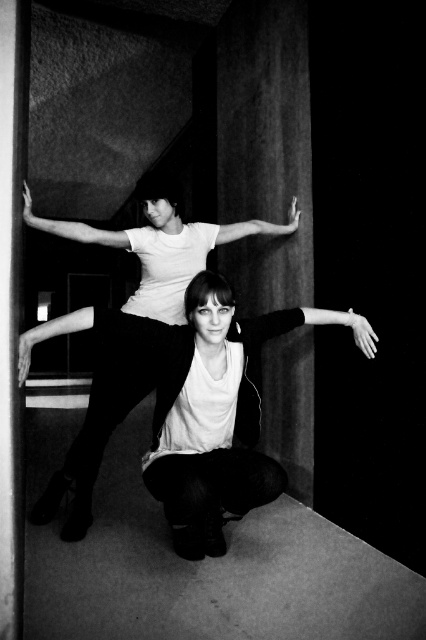
Question: Can you confirm if smooth skin arm at upper left is positioned to the right of matte white arm at center?

Choices:
 (A) no
 (B) yes

Answer: (A)

Question: Can you confirm if white matte t-shirt at center is smaller than smooth skin arm at lower center?

Choices:
 (A) no
 (B) yes

Answer: (A)

Question: Which point is farther to the camera?

Choices:
 (A) click(x=26, y=353)
 (B) click(x=88, y=227)

Answer: (B)

Question: Estimate the real-world distances between objects in this image. Which object is closer to the smooth skin arm at lower center?

Choices:
 (A) matte white arm at center
 (B) smooth skin arm at upper left

Answer: (A)

Question: Which is farther from the matte white arm at upper center?

Choices:
 (A) matte white arm at center
 (B) smooth skin arm at upper left
 (C) white matte t-shirt at center
 (D) matte white shirt at center

Answer: (C)

Question: Observing the image, what is the correct spatial positioning of matte white arm at upper center in reference to smooth skin arm at lower center?

Choices:
 (A) below
 (B) above

Answer: (B)